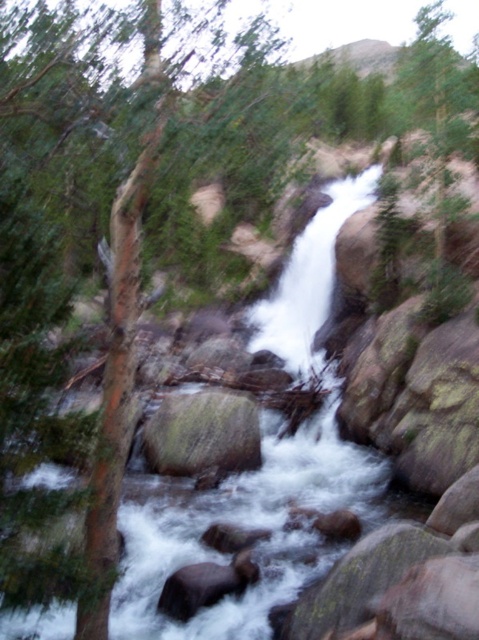
You are standing at the base of the waterfall and want to reach a specific point in the scene. There are two points marked in the image. Which point, point 1 at coordinates (209, 449) or point 2 at coordinates (229, 573), is closer to you?

Point 2 at coordinates (229, 573) is closer to you because point 1 at coordinates (209, 449) is behind it.

You are a hiker trying to cross a stream near the waterfall. You see two rocks in the middle of the stream, the green mossy rock at center and the smooth brown rock at center. Which rock is bigger and safer to step on?

The green mossy rock at center is larger than the smooth brown rock at center, making it a safer option to step on.

Looking at this image, you are standing at the edge of the waterfall and want to place a small weatherproof speaker on the green mossy rock at center. Given that the speaker requires a flat surface of at least 0.5 square meters, can you determine if the rock has enough space?

The green mossy rock at center is located at point coordinates (203, 433). However, the provided information does not specify the size or surface area of the rock. Therefore, it is impossible to determine if the speaker will fit based on the given data.